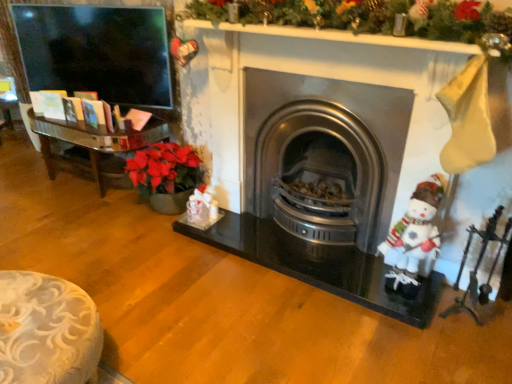
At what (x,y) coordinates should I click in order to perform the action: click on free space in front of stainless steel wood burning stove at center. Please return your answer as a coordinate pair (x, y). The width and height of the screenshot is (512, 384). Looking at the image, I should click on (308, 317).